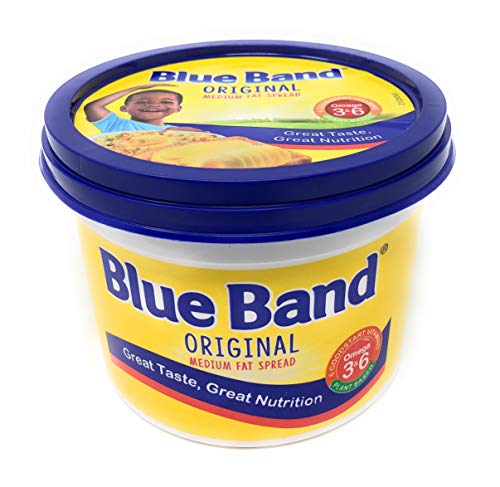
Image resolution: width=500 pixels, height=487 pixels. In order to click on container of butter in this screenshot , I will do `click(281, 264)`.